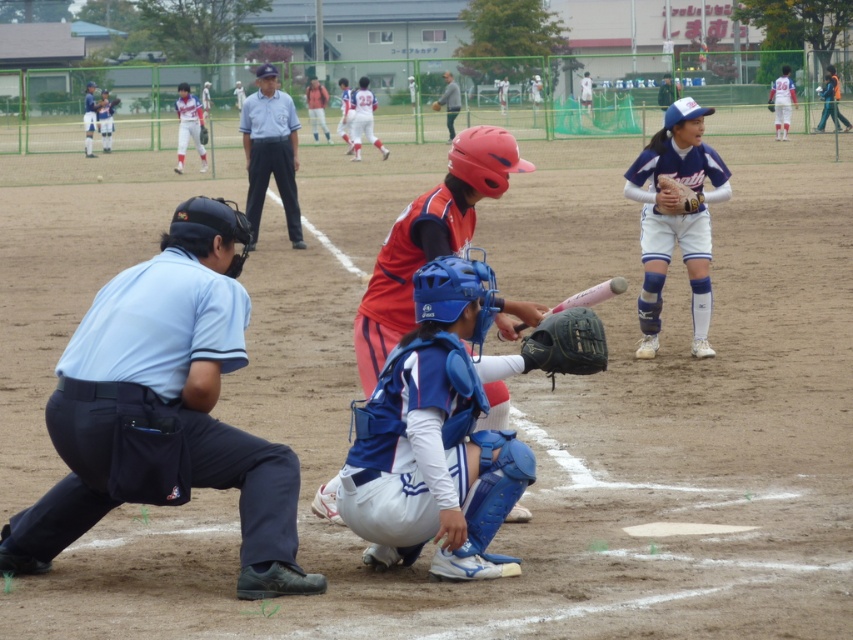
You are a coach observing the game and need to quickly assess the positions of the players. Which object, the light blue uniform at center or the brown leather glove at upper right, is positioned behind the other?

The brown leather glove at upper right is positioned behind the light blue uniform at center.

You are a spectator at the baseball game and want to take a photo of both the light blue uniform at center and the brown leather glove at upper right. Which object should you zoom in on to ensure both are in focus without changing your camera position?

The light blue uniform at center is larger in size compared to the brown leather glove at upper right, so you should focus on the light blue uniform at center to ensure both are in focus.